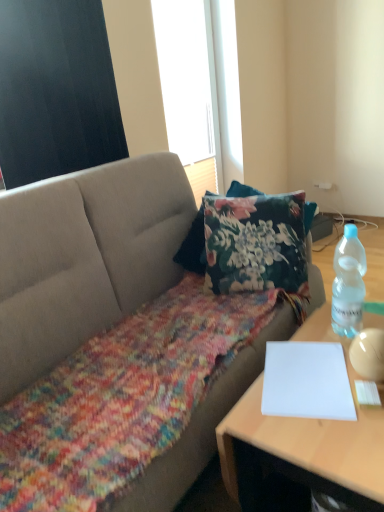
The height and width of the screenshot is (512, 384). What are the coordinates of `free space in front of white paper at lower right` in the screenshot? It's located at (325, 441).